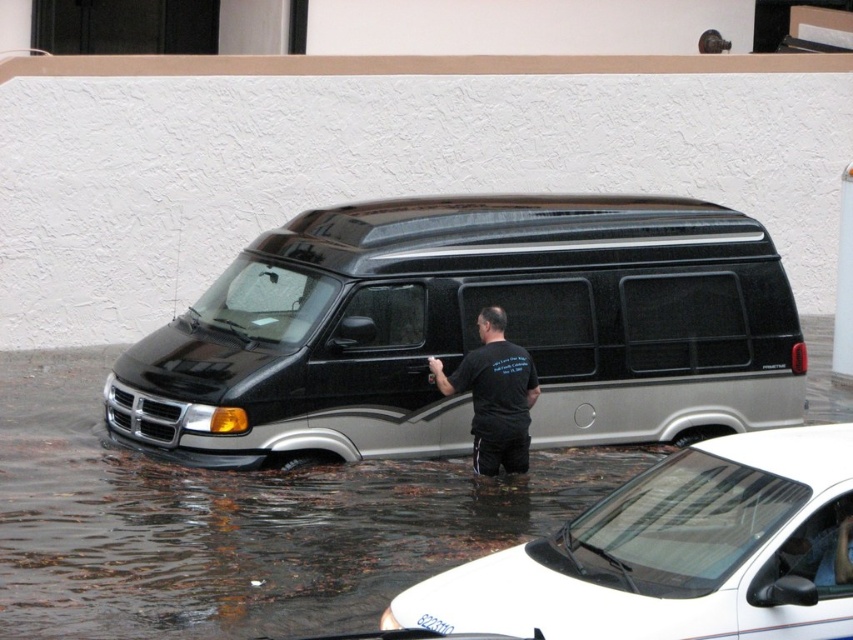
Question: Considering the real-world distances, which object is farthest from the black metallic van at center?

Choices:
 (A) white glossy car at lower center
 (B) black matte shirt at center

Answer: (A)

Question: Which object appears closest to the camera in this image?

Choices:
 (A) black matte shirt at center
 (B) black metallic van at center

Answer: (B)

Question: Is white glossy car at lower center thinner than black matte shirt at center?

Choices:
 (A) yes
 (B) no

Answer: (B)

Question: Can you confirm if black metallic van at center is bigger than white glossy car at lower center?

Choices:
 (A) yes
 (B) no

Answer: (A)

Question: Is black metallic van at center wider than black matte shirt at center?

Choices:
 (A) yes
 (B) no

Answer: (A)

Question: Estimate the real-world distances between objects in this image. Which object is farther from the black metallic van at center?

Choices:
 (A) black matte shirt at center
 (B) white glossy car at lower center

Answer: (B)